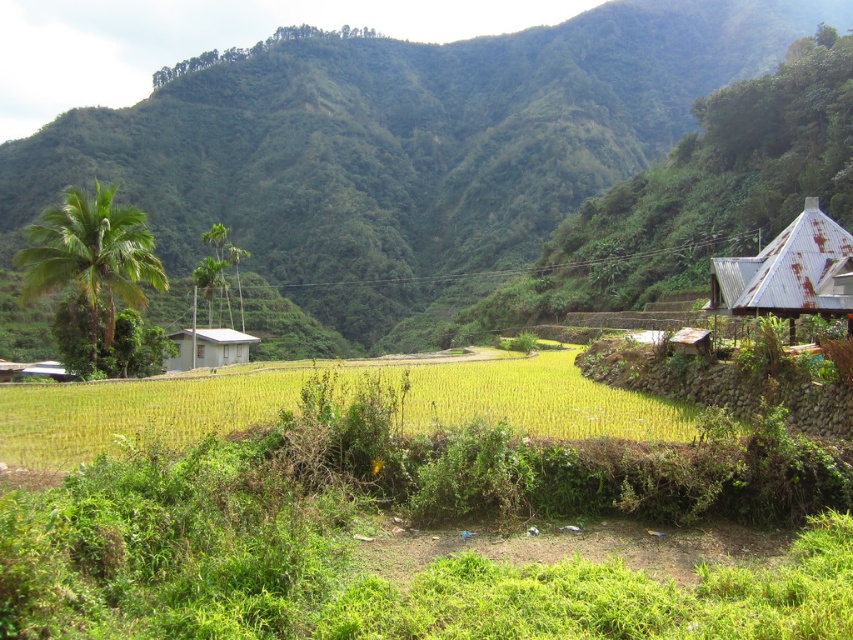
In the scene shown: You are a hiker planning to take a photo of the green leafy mountain at upper center and the rusty metal hut at right. Which object will occupy more space in your photo?

The green leafy mountain at upper center will occupy more space in the photo because its width is larger than the rusty metal hut at right.